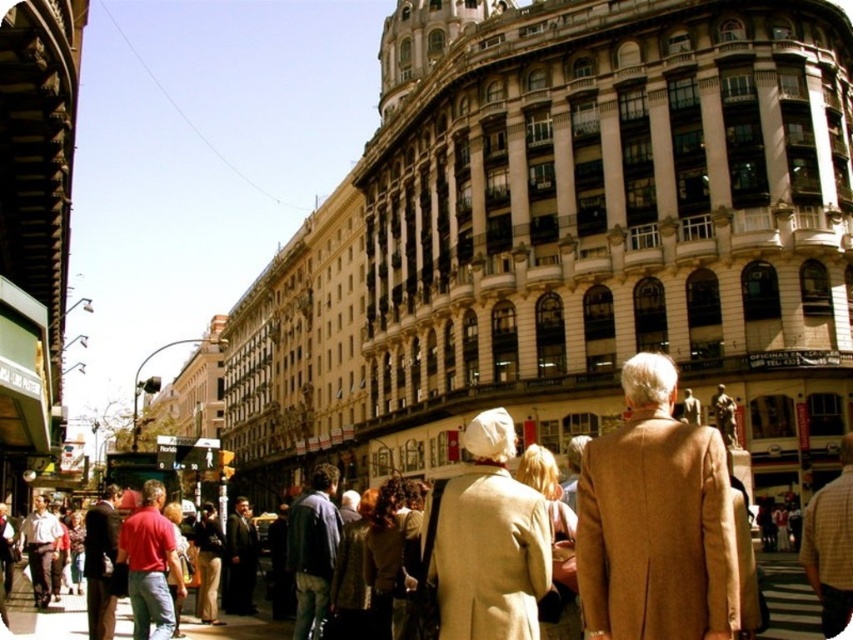
Question: Observing the image, what is the correct spatial positioning of tan wool coat at center in reference to beige wool coat at center?

Choices:
 (A) below
 (B) above

Answer: (B)

Question: Which of the following is the farthest from the observer?

Choices:
 (A) smooth asphalt pavement at center
 (B) beige wool coat at center

Answer: (A)

Question: In this image, where is tan wool coat at center located relative to smooth asphalt pavement at center?

Choices:
 (A) right
 (B) left

Answer: (A)

Question: Among these objects, which one is nearest to the camera?

Choices:
 (A) beige wool coat at center
 (B) smooth asphalt pavement at center

Answer: (A)

Question: Is tan wool coat at center above beige wool coat at center?

Choices:
 (A) yes
 (B) no

Answer: (A)

Question: Which of the following is the farthest from the observer?

Choices:
 (A) tan wool coat at center
 (B) beige wool coat at center

Answer: (B)